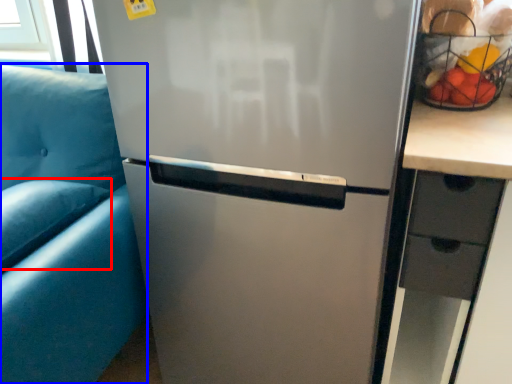
Question: Among these objects, which one is farthest to the camera, pillow (highlighted by a red box) or armchair (highlighted by a blue box)?

Choices:
 (A) pillow
 (B) armchair

Answer: (A)